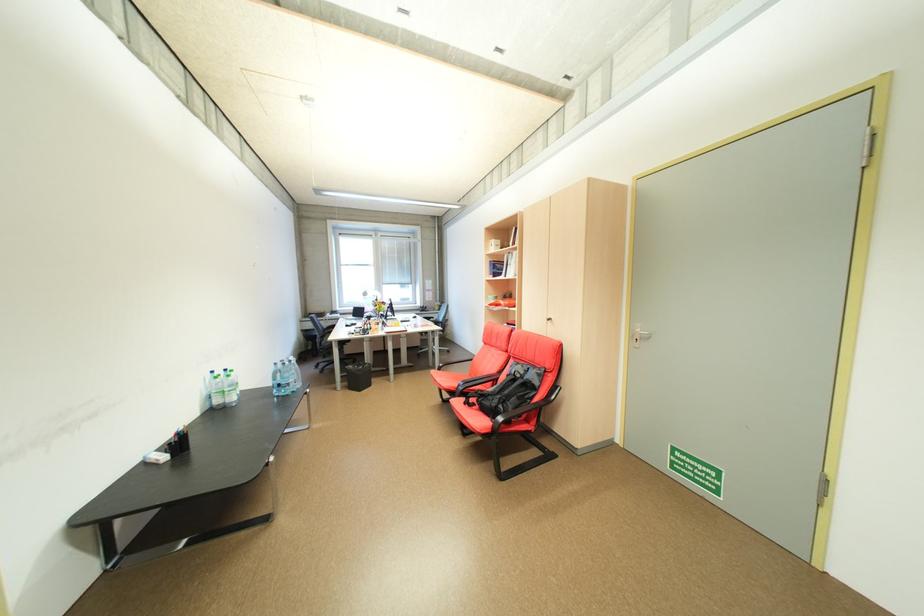
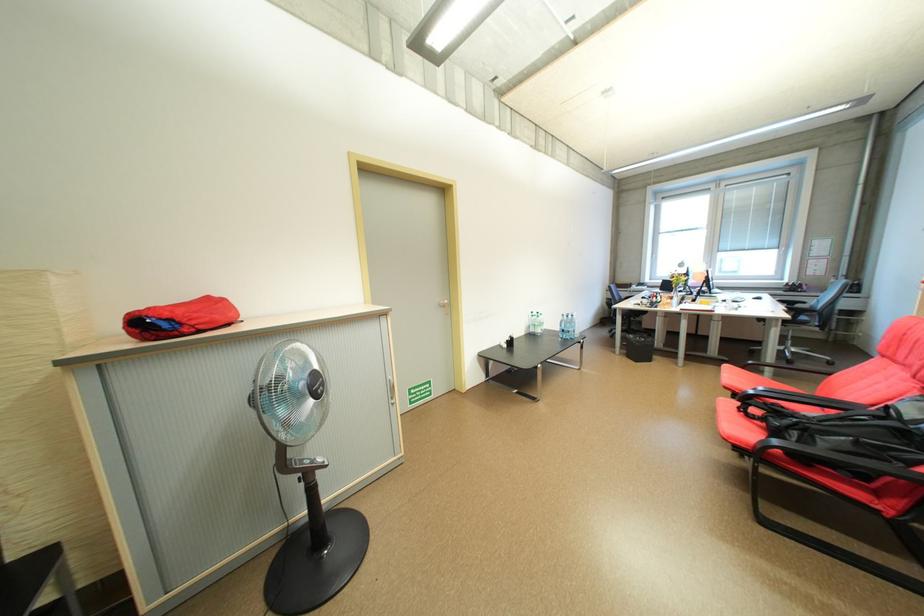
The point at [350,383] is marked in the first image. Where is the corresponding point in the second image?

(630, 349)